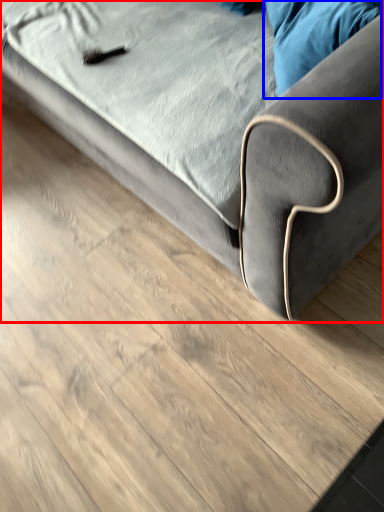
Question: Among these objects, which one is nearest to the camera, studio couch (highlighted by a red box) or pillow (highlighted by a blue box)?

Choices:
 (A) studio couch
 (B) pillow

Answer: (A)